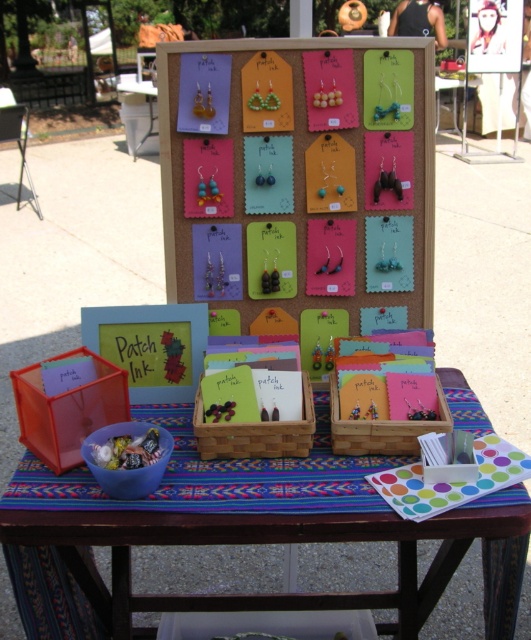
You are a customer at the craft stall and want to pick up the translucent plastic candy container at lower left and the black matte tank top at upper center. Which item should you reach for first if you want to grab the one that is closer to you?

The translucent plastic candy container at lower left is located below the black matte tank top at upper center, so it is closer to you. You should reach for the translucent plastic candy container at lower left first.

You are a customer at the craft stall and want to buy both the translucent plastic candy container at lower left and the black matte tank top at upper center. However, you have a small backpack with limited space. Which item should you place first into your backpack to ensure both fit?

You should place the black matte tank top at upper center first because the translucent plastic candy container at lower left is smaller and can fit into the remaining space afterward.

You are a customer at the craft stall and want to know if the translucent plastic candy container at lower left can fit inside the black matte tank top at upper center. Can it fit vertically?

The translucent plastic candy container at lower left is not as tall as the black matte tank top at upper center, so it might fit vertically inside the tank top.